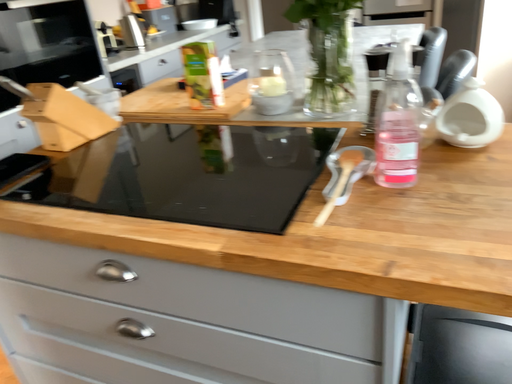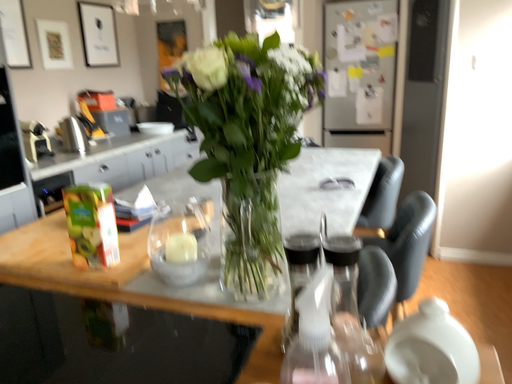
Question: How did the camera likely rotate when shooting the video?

Choices:
 (A) rotated upward
 (B) rotated downward

Answer: (A)